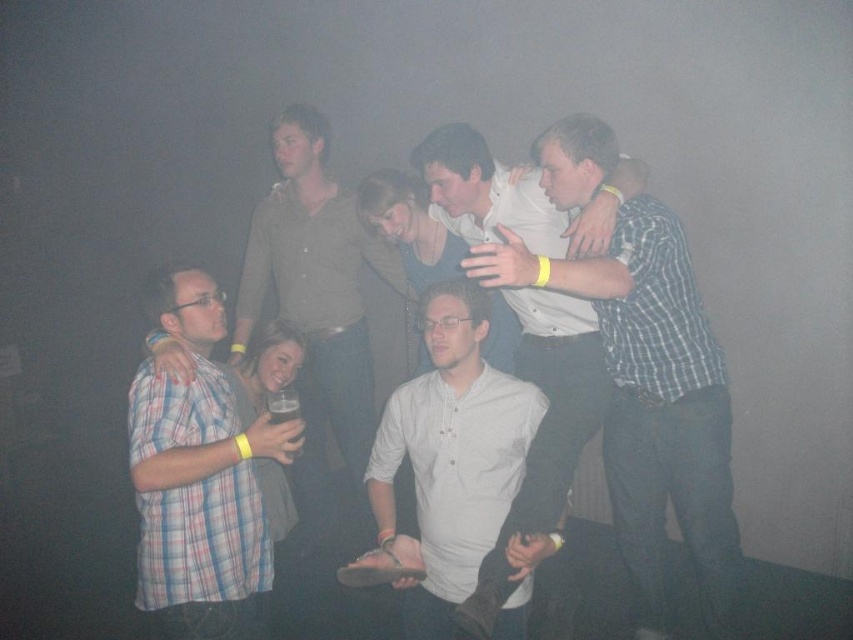
Question: Which of the following is the closest to the observer?

Choices:
 (A) checkered fabric shirt at center
 (B) plaid shirt at left
 (C) white matte shirt at center

Answer: (A)

Question: Observing the image, what is the correct spatial positioning of plaid shirt at left in reference to white matte shirt at center?

Choices:
 (A) below
 (B) above

Answer: (A)

Question: Among these objects, which one is nearest to the camera?

Choices:
 (A) checkered fabric shirt at center
 (B) white matte shirt at center
 (C) plaid shirt at left

Answer: (A)

Question: Which object is closer to the camera taking this photo?

Choices:
 (A) checkered fabric shirt at center
 (B) white matte shirt at center

Answer: (A)

Question: Is the position of checkered fabric shirt at center less distant than that of plaid shirt at left?

Choices:
 (A) yes
 (B) no

Answer: (A)

Question: Can you confirm if checkered fabric shirt at center is wider than white matte shirt at center?

Choices:
 (A) yes
 (B) no

Answer: (A)